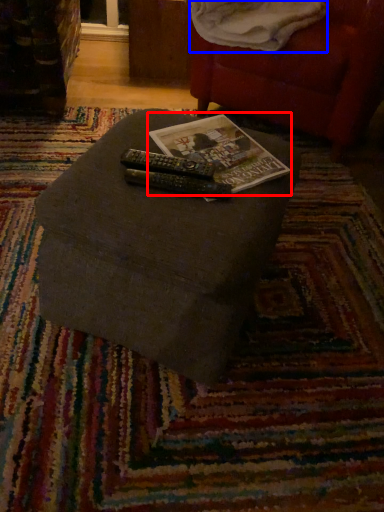
Question: Among these objects, which one is farthest to the camera, paperback book (highlighted by a red box) or blanket (highlighted by a blue box)?

Choices:
 (A) paperback book
 (B) blanket

Answer: (B)